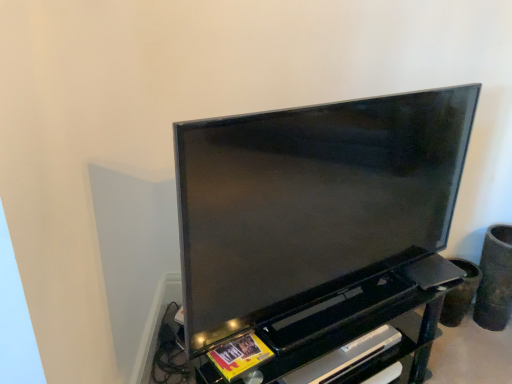
Identify the location of vacant location below matte black tv at center (from a real-world perspective). pos(322,308).